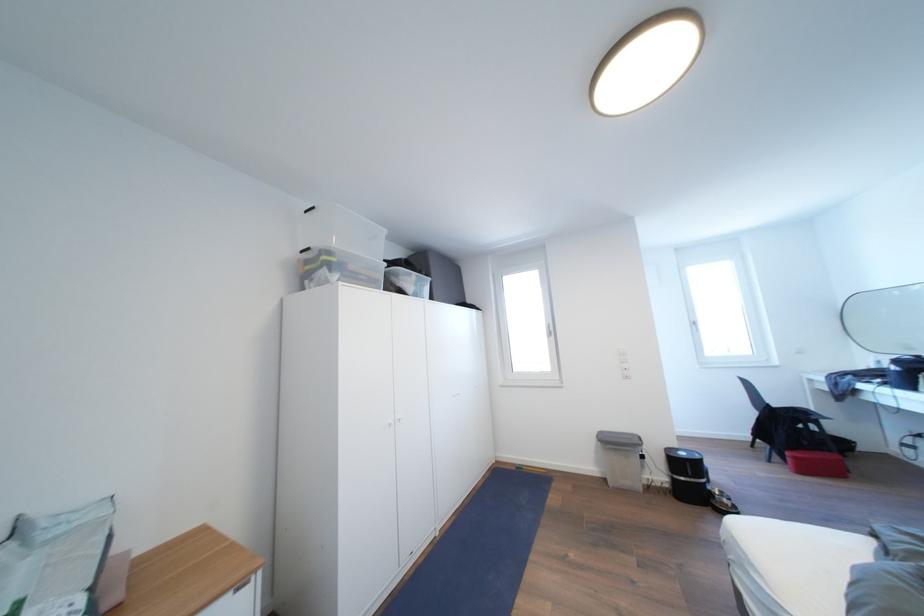
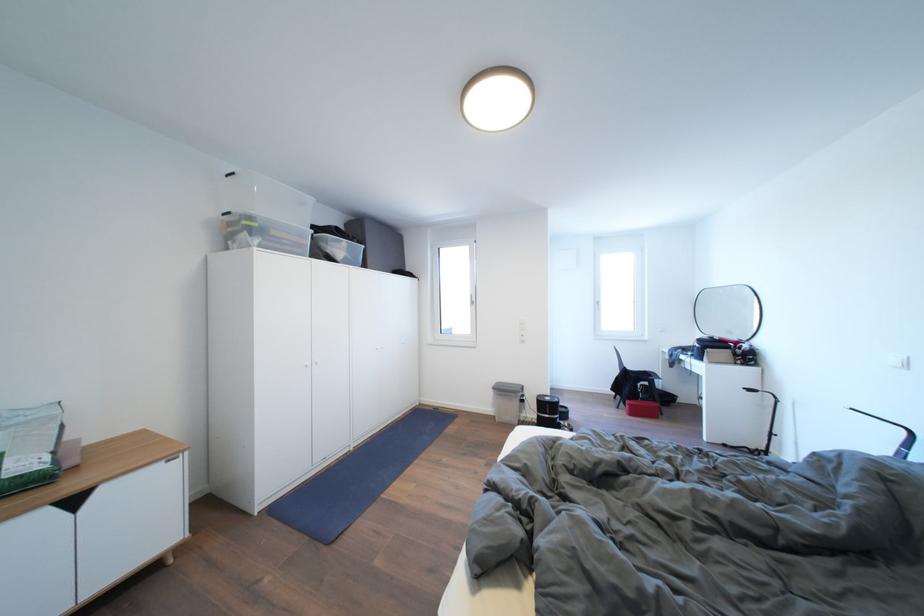
Question: The first image is from the beginning of the video and the second image is from the end. How did the camera likely rotate when shooting the video?

Choices:
 (A) Left
 (B) Right
 (C) Up
 (D) Down

Answer: (D)